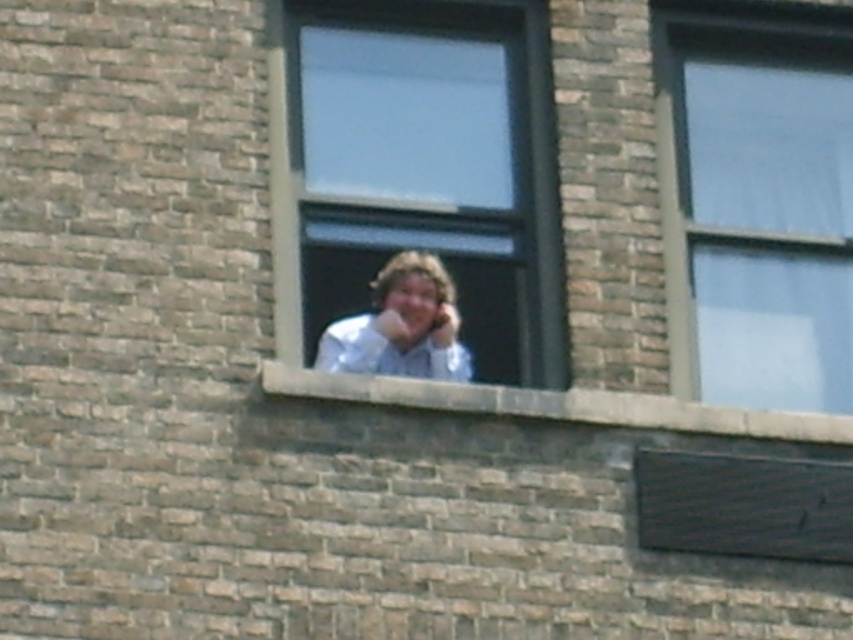
You are standing in a park across from a brick building. You see the clear glass window at center. Can you comfortably read a book while sitting on a bench 30 meters away from the window?

The clear glass window at center is 31.33 meters away from the viewer. Since the bench is only 30 meters away, you are closer than the window, so the distance should allow comfortable reading as you are nearer to the window than the stated distance.

You are standing at the base of the brick building and want to throw a small ball to the transparent glass window at upper right. The ball can travel up to 30 meters. Will it reach the window?

The transparent glass window at upper right is 32.42 meters from the viewer, which is beyond the ball travel distance of 30 meters. The ball will not reach the window.